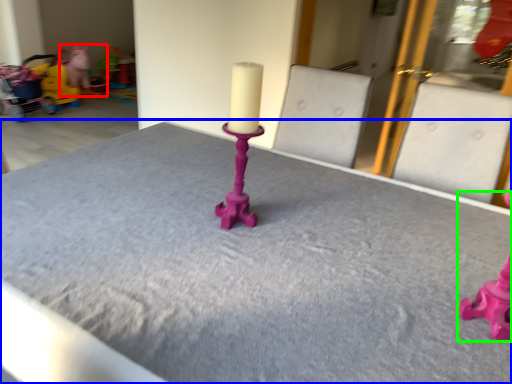
Question: Based on their relative distances, which object is farther from toy (highlighted by a red box)? Choose from table (highlighted by a blue box) and toy (highlighted by a green box).

Choices:
 (A) table
 (B) toy

Answer: (B)